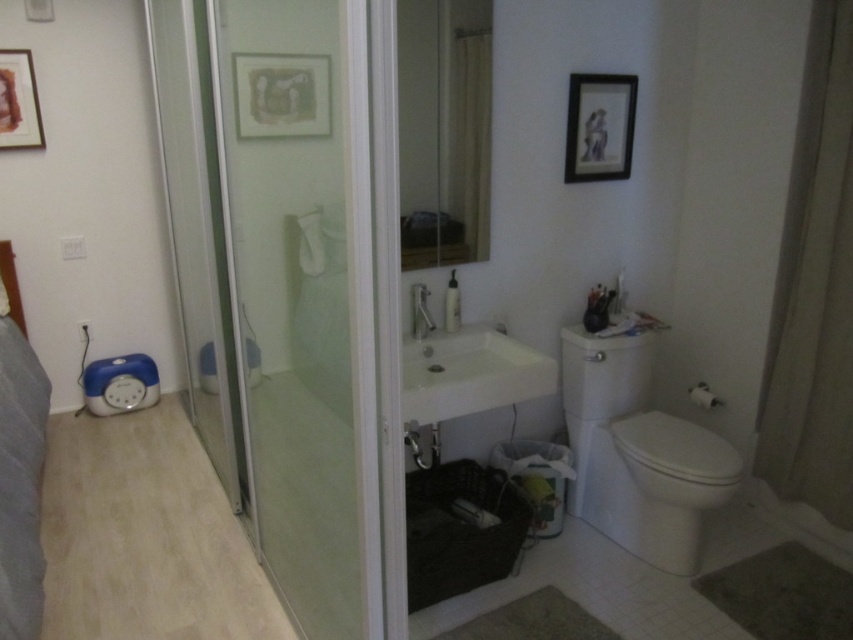
Question: Considering the real-world distances, which object is farthest from the clear glass shower door at left?

Choices:
 (A) white glossy toilet at right
 (B) beige fabric curtain at right
 (C) matte black picture frame at upper center

Answer: (B)

Question: Which of the following is the closest to the observer?

Choices:
 (A) (634, 397)
 (B) (477, 360)
 (C) (370, 605)

Answer: (C)

Question: Is transparent glass shower door at left above matte black picture frame at upper center?

Choices:
 (A) no
 (B) yes

Answer: (A)

Question: Is matte paper picture frame at upper center positioned at the back of wooden framed artwork at upper left?

Choices:
 (A) yes
 (B) no

Answer: (B)

Question: Does clear glass shower door at left appear on the left side of white glossy sink at center?

Choices:
 (A) yes
 (B) no

Answer: (A)

Question: Which object is the closest to the wooden framed artwork at upper left?

Choices:
 (A) matte black picture frame at upper center
 (B) beige fabric curtain at right
 (C) transparent glass shower door at left
 (D) white glossy sink at center

Answer: (C)